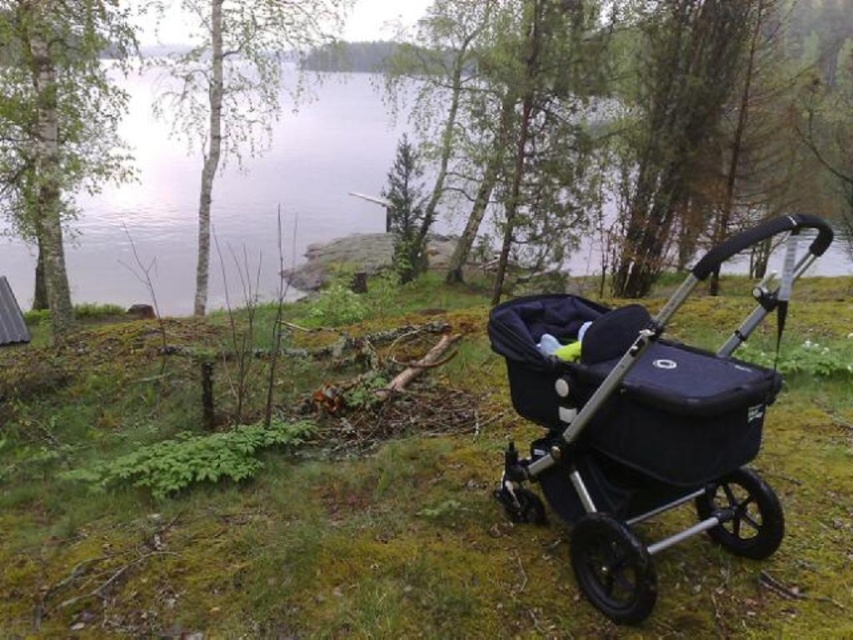
Question: Based on their relative distances, which object is farther from the clear water at center?

Choices:
 (A) black fabric stroller at center
 (B) green mossy grass at lower right

Answer: (B)

Question: Can you confirm if black fabric stroller at center is bigger than clear water at center?

Choices:
 (A) no
 (B) yes

Answer: (A)

Question: Which point appears farthest from the camera in this image?

Choices:
 (A) (844, 579)
 (B) (534, 476)
 (C) (383, 138)

Answer: (C)

Question: Considering the real-world distances, which object is closest to the green mossy grass at lower right?

Choices:
 (A) black fabric stroller at center
 (B) clear water at center

Answer: (A)

Question: Is green mossy grass at lower right above clear water at center?

Choices:
 (A) yes
 (B) no

Answer: (B)

Question: Does black fabric stroller at center appear on the right side of clear water at center?

Choices:
 (A) no
 (B) yes

Answer: (B)